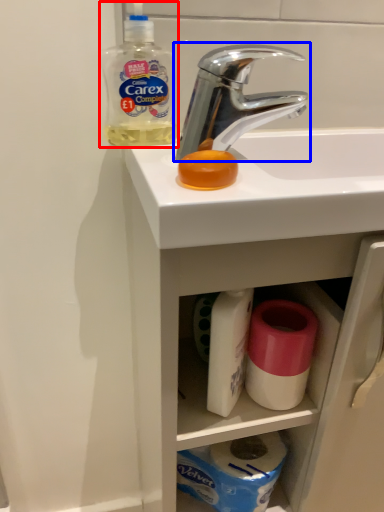
Question: Which object is closer to the camera taking this photo, cleaning product (highlighted by a red box) or tap (highlighted by a blue box)?

Choices:
 (A) cleaning product
 (B) tap

Answer: (B)